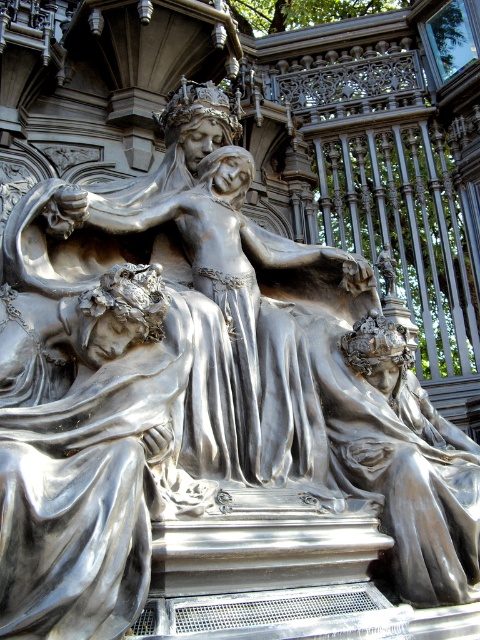
Question: Considering the relative positions of shiny silver figure at lower left and shiny silver statue at center in the image provided, where is shiny silver figure at lower left located with respect to shiny silver statue at center?

Choices:
 (A) below
 (B) above

Answer: (A)

Question: Is shiny silver figure at lower left to the left of shiny silver statue at center from the viewer's perspective?

Choices:
 (A) yes
 (B) no

Answer: (A)

Question: Which point is closer to the camera?

Choices:
 (A) (228, 161)
 (B) (55, 449)

Answer: (B)

Question: Is shiny silver figure at lower left to the right of shiny silver statue at center from the viewer's perspective?

Choices:
 (A) yes
 (B) no

Answer: (B)

Question: Among these objects, which one is farthest from the camera?

Choices:
 (A) shiny silver figure at lower left
 (B) shiny silver statue at center

Answer: (B)